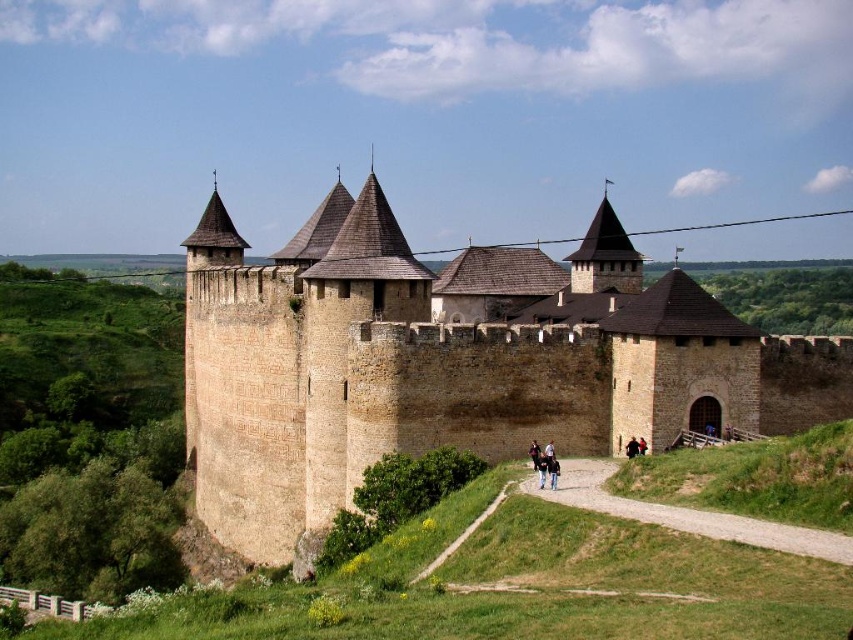
Question: From the image, what is the correct spatial relationship of black leather jacket at center in relation to black fabric person at center?

Choices:
 (A) right
 (B) left

Answer: (B)

Question: Which of the following is the closest to the observer?

Choices:
 (A) black leather jacket at center
 (B) dirt/gravel path at center
 (C) black fabric person at center
 (D) brown stone castle at center

Answer: (B)

Question: Considering the real-world distances, which object is closest to the dirt/gravel path at center?

Choices:
 (A) brown stone castle at center
 (B) black fabric person at center
 (C) black leather jacket at center

Answer: (C)

Question: Which object is closer to the camera taking this photo?

Choices:
 (A) brown stone castle at center
 (B) black fabric person at center
 (C) dirt/gravel path at center

Answer: (C)

Question: Does brown stone castle at center have a smaller size compared to black leather jacket at center?

Choices:
 (A) no
 (B) yes

Answer: (A)

Question: Does dirt/gravel path at center have a lesser width compared to black fabric person at center?

Choices:
 (A) no
 (B) yes

Answer: (A)